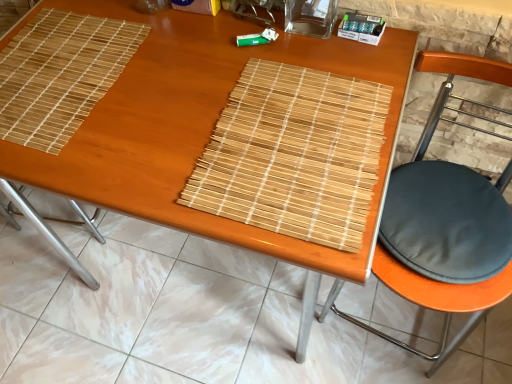
You are a GUI agent. You are given a task and a screenshot of the screen. Output one action in this format:
    pyautogui.click(x=<x>, y=<y>)
    Task: Click on the free point below natural wood mat at upper left, positioned as the second mat in right-to-left order (from a real-world perspective)
    This screenshot has width=512, height=384.
    Given the screenshot: What is the action you would take?
    pyautogui.click(x=57, y=75)